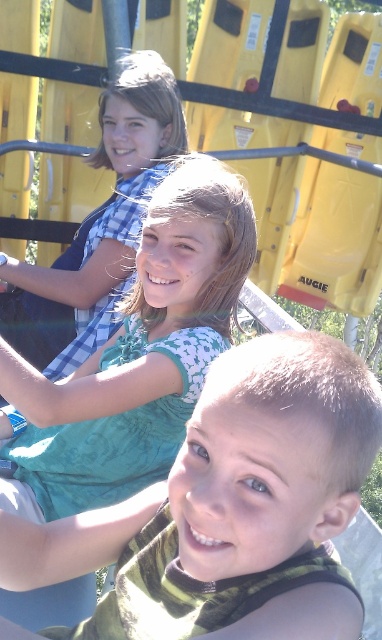
Question: Can you confirm if green fabric shirt at center is positioned to the right of green fabric shirt at upper center?

Choices:
 (A) no
 (B) yes

Answer: (B)

Question: Which point is closer to the camera taking this photo?

Choices:
 (A) (178, 477)
 (B) (132, 413)

Answer: (A)

Question: Among these objects, which one is farthest from the camera?

Choices:
 (A) green fabric shirt at upper center
 (B) green fabric shirt at center

Answer: (A)

Question: Where is green fabric shirt at center located in relation to green fabric shirt at upper center in the image?

Choices:
 (A) below
 (B) above

Answer: (A)

Question: Which point is farther to the camera?

Choices:
 (A) (333, 340)
 (B) (126, 492)

Answer: (B)

Question: Observing the image, what is the correct spatial positioning of green fabric shirt at center in reference to green fabric shirt at upper center?

Choices:
 (A) above
 (B) below

Answer: (B)